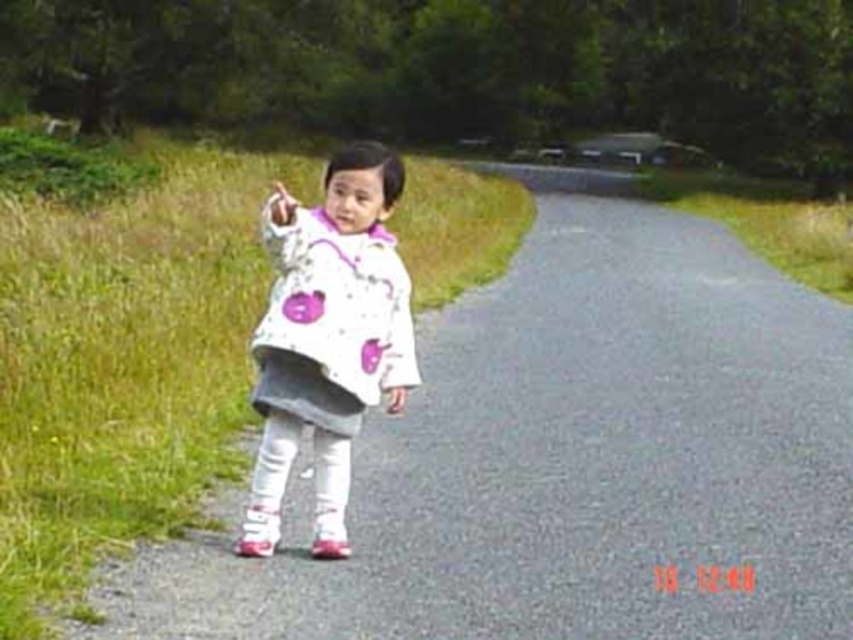
Question: Which object is closer to the camera taking this photo?

Choices:
 (A) white matte hand at center
 (B) white matte jacket at center
 (C) asphalt road at center

Answer: (C)

Question: Which of the following is the farthest from the observer?

Choices:
 (A) white matte jacket at center
 (B) white matte hand at center

Answer: (A)

Question: Does asphalt road at center lie behind white matte hand at center?

Choices:
 (A) yes
 (B) no

Answer: (B)

Question: Is asphalt road at center further to camera compared to white matte hand at center?

Choices:
 (A) no
 (B) yes

Answer: (A)

Question: Which point is closer to the camera?

Choices:
 (A) 647,221
 (B) 277,253

Answer: (B)

Question: Is white matte jacket at center behind white matte hand at center?

Choices:
 (A) yes
 (B) no

Answer: (A)